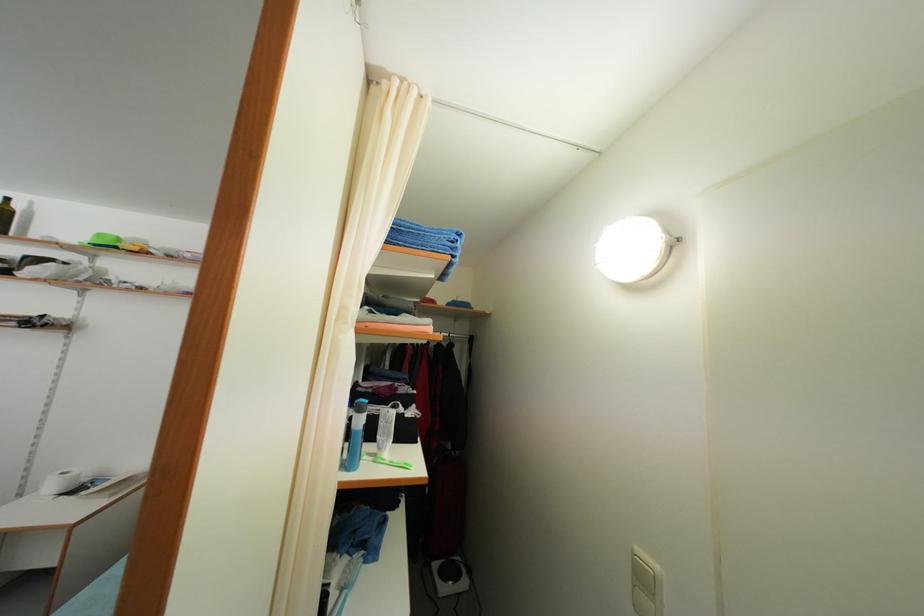
Identify the location of blue spray bottle. point(356,435).